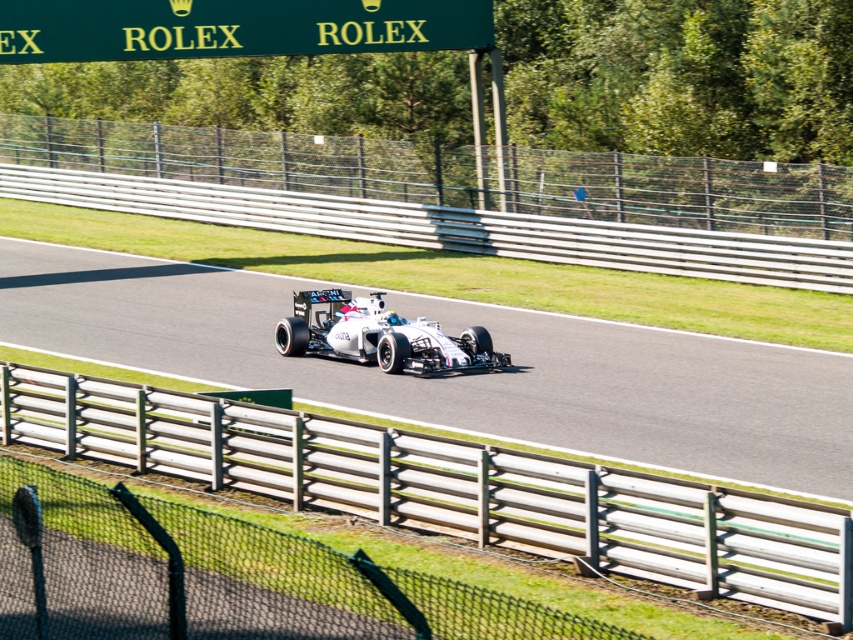
Is white asphalt race track at center to the left of green sign at upper center from the viewer's perspective?

No, white asphalt race track at center is not to the left of green sign at upper center.

Between white asphalt race track at center and green sign at upper center, which one is positioned higher?

green sign at upper center is higher up.

What are the coordinates of `white asphalt race track at center` in the screenshot? It's located at (461, 374).

Find the location of a particular element. The width and height of the screenshot is (853, 640). white asphalt race track at center is located at coordinates (461, 374).

Does white asphalt race track at center appear under white metallic race car at center?

No, white asphalt race track at center is not below white metallic race car at center.

Can you confirm if white asphalt race track at center is wider than white metallic race car at center?

Indeed, white asphalt race track at center has a greater width compared to white metallic race car at center.

Which is behind, point (820, 387) or point (368, 360)?

Point (368, 360)

Where is `white asphalt race track at center`? This screenshot has height=640, width=853. white asphalt race track at center is located at coordinates (461, 374).

Is point (259, 13) less distant than point (445, 360)?

That is False.

Between green sign at upper center and white metallic race car at center, which one is positioned higher?

green sign at upper center

Who is more distant from viewer, [402,48] or [491,349]?

The point [402,48] is behind.

Find the location of a particular element. This screenshot has width=853, height=640. green sign at upper center is located at coordinates (234, 28).